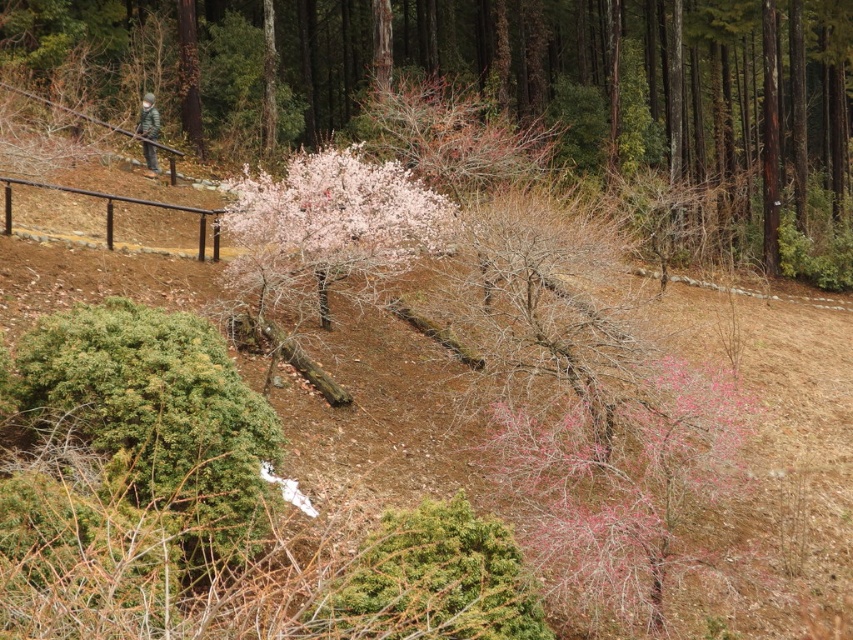
You are standing on the pathway and want to take a photo of the camouflage fabric person at upper left without the pink textured bush at center blocking the view. Is this possible?

The pink textured bush at center is positioned over the camouflage fabric person at upper left, so taking a photo without the bush blocking the view would not be possible unless moving to a different angle or position where the bush is no longer in front.

You are a hiker who needs to reach the pink matte tree at center from your current position near the camouflage fabric person at upper left. Can you estimate how far you have to walk to get there?

The distance between the pink matte tree at center and the camouflage fabric person at upper left is 7.95 meters, so you have to walk approximately 8 meters to reach the pink matte tree at center.

You are standing on the pathway and see the pink textured bush at center and the camouflage fabric person at upper left. Which object is closer to your right side?

The pink textured bush at center is closer to your right side because it is positioned to the right of the camouflage fabric person at upper left.